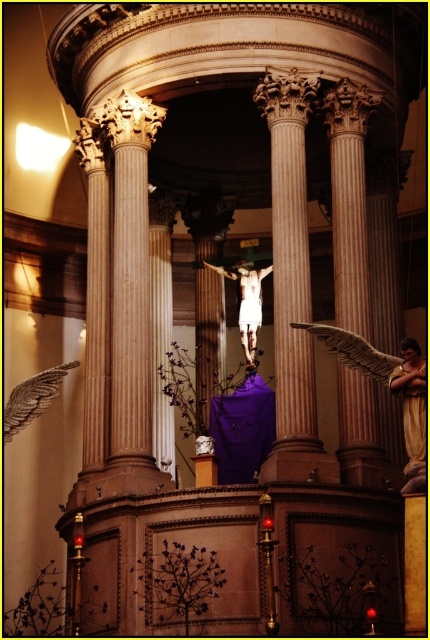
You are an architect designing a new cathedral and want to ensure that the polished marble column at center and the white marble crucifix at center are spaced appropriately for a grand yet harmonious appearance. Given that the standard spacing between such elements in classical architecture is typically between 6 to 8 meters, does the current distance of 7.25 meters between them align with this guideline?

The distance between the polished marble column at center and the white marble crucifix at center is 7.25 meters, which falls within the recommended 6 to 8 meters range for classical architecture. This spacing aligns well with the guideline, ensuring a harmonious and grand appearance.